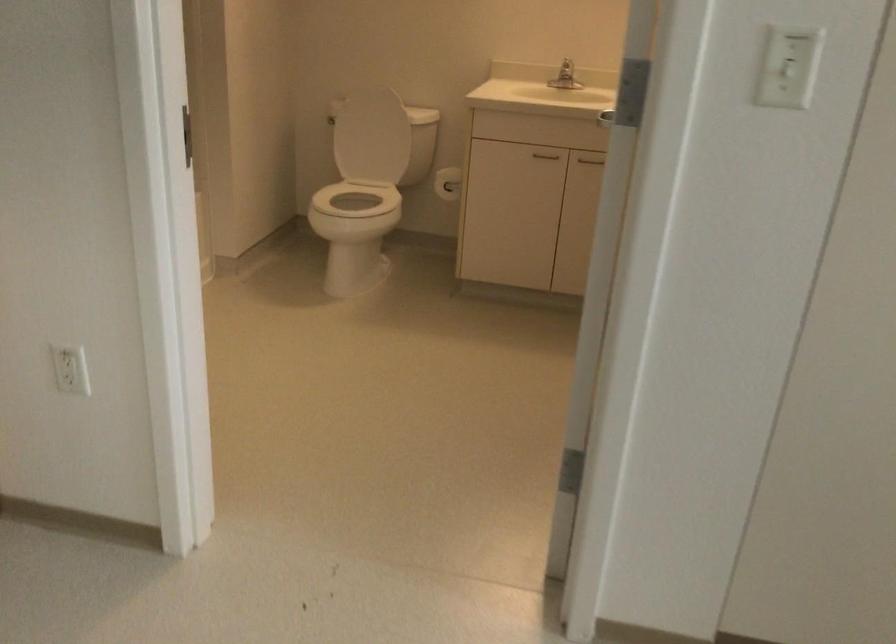
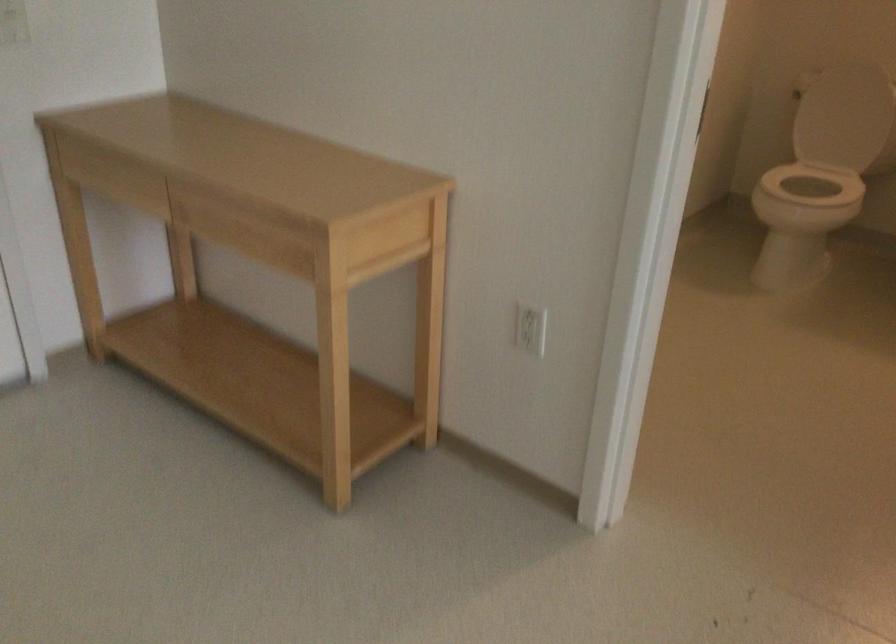
Find the pixel in the second image that matches (356,147) in the first image.

(839, 118)